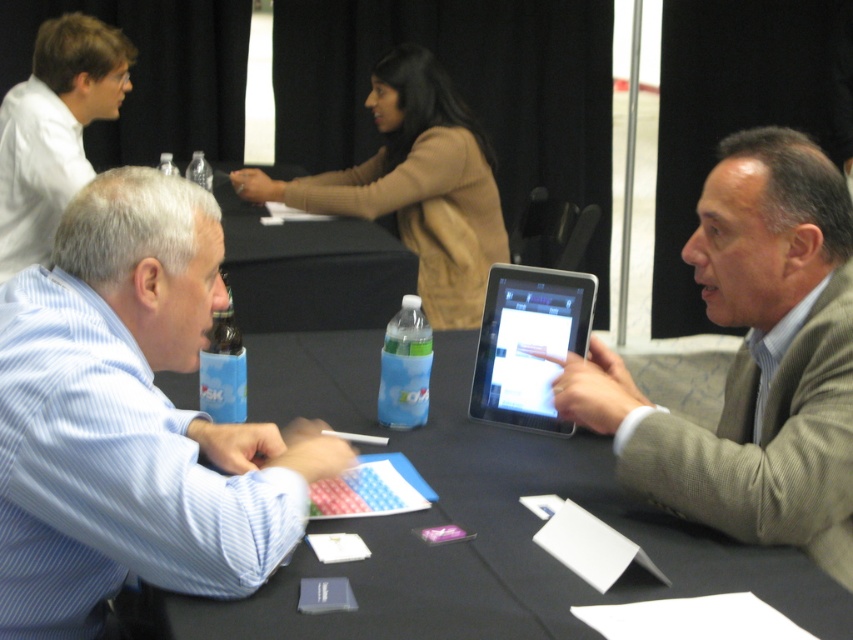
You are standing at the table in the scene. You need to place a new item between the two points labeled point [469,426] and point [538,316]. Which point should the item be placed closer to so it is in front of the other point?

The item should be placed closer to point [538,316] because point [469,426] is behind point [538,316], so placing it near the front point would keep it in front of the other.

You are sitting at the table and want to place a new item between the black fabric table at center and the black glossy tablet at center. Is there enough space for the item?

The black fabric table at center is in front of the black glossy tablet at center, so there is space between them to place the new item.